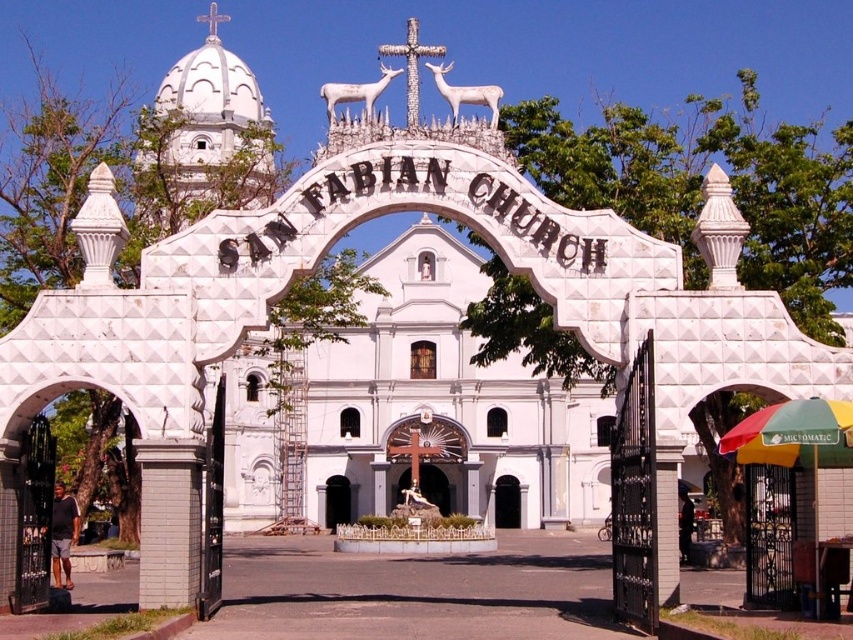
Question: Does white matte deer at upper center appear on the left side of white stone archway at center?

Choices:
 (A) yes
 (B) no

Answer: (B)

Question: Is black matte door at center to the right of white stone archway at center from the viewer's perspective?

Choices:
 (A) no
 (B) yes

Answer: (B)

Question: Can you confirm if white matte deer at upper center is smaller than black matte door at center?

Choices:
 (A) no
 (B) yes

Answer: (A)

Question: Which point is closer to the camera?

Choices:
 (A) white stone archway at center
 (B) white matte deer at upper center
 (C) black matte door at center
 (D) white matte deer at center

Answer: (B)

Question: Estimate the real-world distances between objects in this image. Which object is closer to the white matte deer at center?

Choices:
 (A) white matte deer at upper center
 (B) white stone archway at center

Answer: (A)

Question: Which object is the farthest from the black matte door at center?

Choices:
 (A) white stone archway at center
 (B) white matte deer at upper center
 (C) white matte deer at center

Answer: (C)